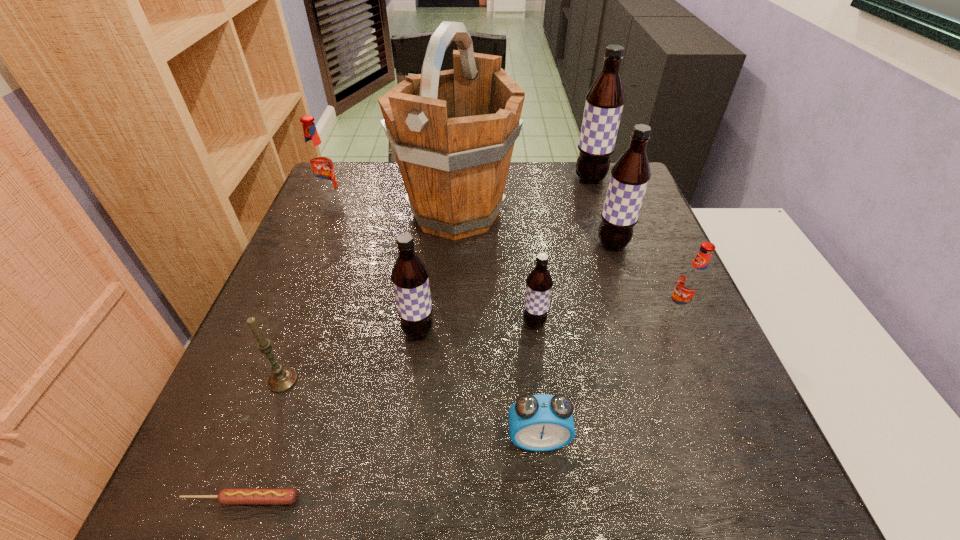
This screenshot has height=540, width=960. I want to click on free space that is in between the bucket and the leftmost root beer, so click(x=393, y=207).

This screenshot has width=960, height=540. Find the location of `object that is the fourth closest to the rightmost object`. object that is the fourth closest to the rightmost object is located at coordinates (x=542, y=422).

Find the location of a particular element. object that ranks as the third closest to the second farthest root beer is located at coordinates (282, 378).

Where is `the third closest root beer to the rightmost object`? Image resolution: width=960 pixels, height=540 pixels. the third closest root beer to the rightmost object is located at coordinates (604, 104).

Select which root beer appears as the fourth closest to the left red root beer. Please provide its 2D coordinates. Your answer should be formatted as a tuple, i.e. [(x, y)], where the tuple contains the x and y coordinates of a point satisfying the conditions above.

[(630, 175)]

Image resolution: width=960 pixels, height=540 pixels. Find the location of `brown root beer that stands as the third closest to the second brown root beer from left to right`. brown root beer that stands as the third closest to the second brown root beer from left to right is located at coordinates (604, 104).

The image size is (960, 540). I want to click on brown root beer that stands as the closest to the fifth root beer from right to left, so click(539, 282).

Image resolution: width=960 pixels, height=540 pixels. I want to click on free region that satisfies the following two spatial constraints: 1. on the back side of the candle; 2. on the right side of the right red root beer, so click(x=308, y=312).

Where is `vacant space that satisfies the following two spatial constraints: 1. on the back side of the second farthest brown root beer; 2. on the left side of the third brown root beer from right to left`? vacant space that satisfies the following two spatial constraints: 1. on the back side of the second farthest brown root beer; 2. on the left side of the third brown root beer from right to left is located at coordinates (525, 244).

The height and width of the screenshot is (540, 960). What are the coordinates of `vacant position in the image that satisfies the following two spatial constraints: 1. on the back side of the fifth root beer from right to left; 2. on the right side of the smaller red root beer` in the screenshot? It's located at tap(420, 312).